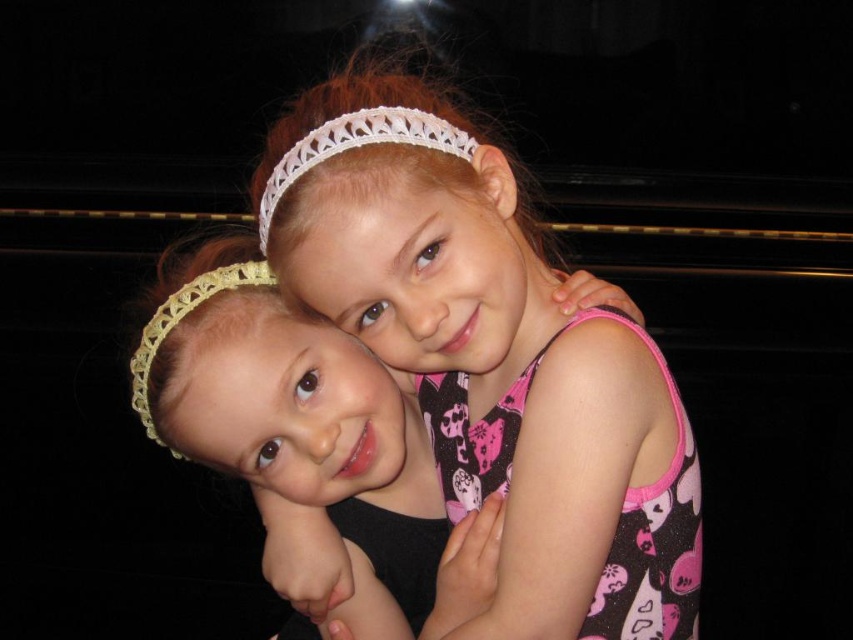
You are a photographer setting up a shoot for these two children. You need to ensure that the pink fabric dress at center and the yellow crochet headband at left are both visible in the frame. Given their sizes, which object should you focus on to ensure both are in the shot without needing to adjust the camera angle?

The pink fabric dress at center is larger in size than the yellow crochet headband at left, so focusing on the pink fabric dress at center would ensure both objects are visible without needing to adjust the camera angle.